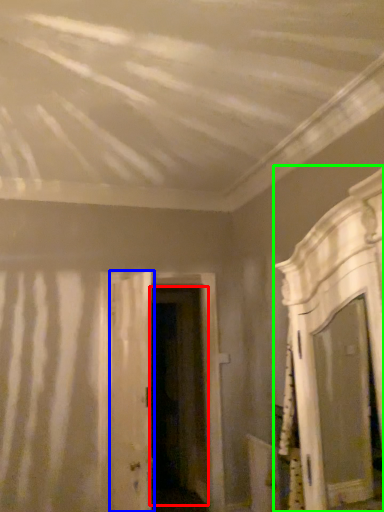
Question: Which object is positioned closest to door (highlighted by a red box)? Select from door (highlighted by a blue box) and furniture (highlighted by a green box).

Choices:
 (A) door
 (B) furniture

Answer: (A)